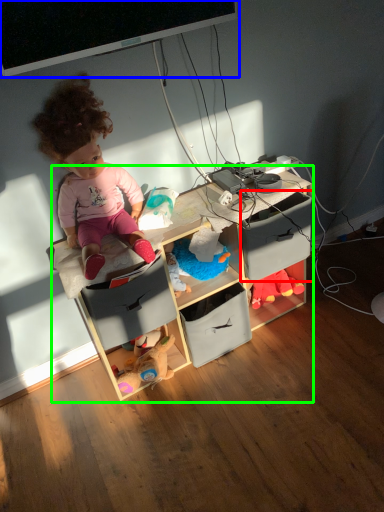
Question: Which is nearer to the drawer (highlighted by a red box)? computer monitor (highlighted by a blue box) or shelf (highlighted by a green box).

Choices:
 (A) computer monitor
 (B) shelf

Answer: (B)